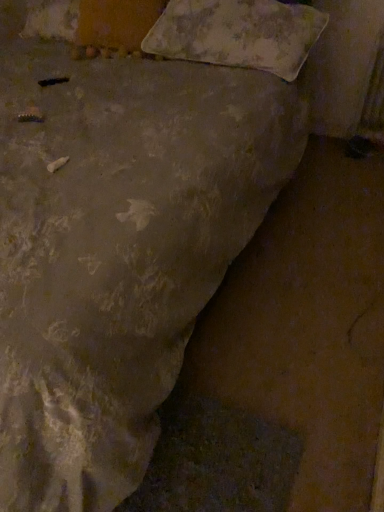
What is the approximate width of fluffy beige pillow at upper center?

16.88 inches.

What do you see at coordinates (237, 34) in the screenshot?
I see `fluffy beige pillow at upper center` at bounding box center [237, 34].

The height and width of the screenshot is (512, 384). In order to click on fluffy beige pillow at upper center in this screenshot , I will do `click(237, 34)`.

You are a GUI agent. You are given a task and a screenshot of the screen. Output one action in this format:
    pyautogui.click(x=<x>, y=<y>)
    Task: Click on the fluffy beige pillow at upper center
    
    Given the screenshot: What is the action you would take?
    pyautogui.click(x=237, y=34)